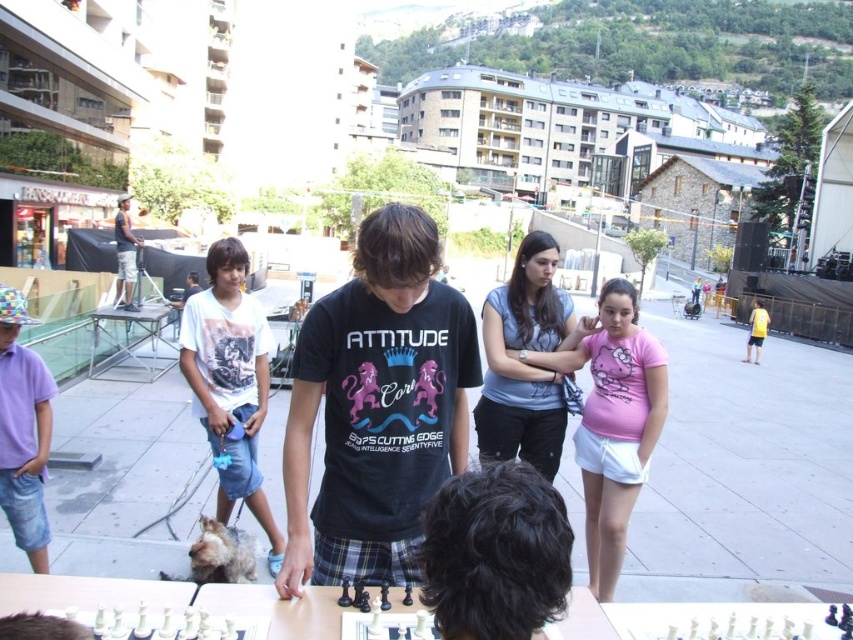
Is the position of pink cotton shirt at center more distant than that of dark blue denim shorts at left?

No, it is in front of dark blue denim shorts at left.

Between pink cotton shirt at center and dark blue denim shorts at left, which one is positioned higher?

dark blue denim shorts at left is above.

What do you see at coordinates (612, 420) in the screenshot?
I see `pink cotton shirt at center` at bounding box center [612, 420].

I want to click on pink cotton shirt at center, so click(612, 420).

Measure the distance from black cotton shirt at center to light blue cotton shirt at center.

black cotton shirt at center and light blue cotton shirt at center are 2.54 meters apart.

Does point (413, 387) come in front of point (503, 321)?

Yes, point (413, 387) is closer to viewer.

Locate an element on the screen. The image size is (853, 640). black cotton shirt at center is located at coordinates (376, 406).

The height and width of the screenshot is (640, 853). In order to click on black cotton shirt at center in this screenshot , I will do `click(376, 406)`.

Who is lower down, black cotton shirt at center or white printed t-shirt at center?

white printed t-shirt at center is below.

Is black cotton shirt at center above white printed t-shirt at center?

Indeed, black cotton shirt at center is positioned over white printed t-shirt at center.

Between point (432, 371) and point (236, 484), which one is positioned behind?

Point (236, 484)

Identify the location of black cotton shirt at center. This screenshot has height=640, width=853. (376, 406).